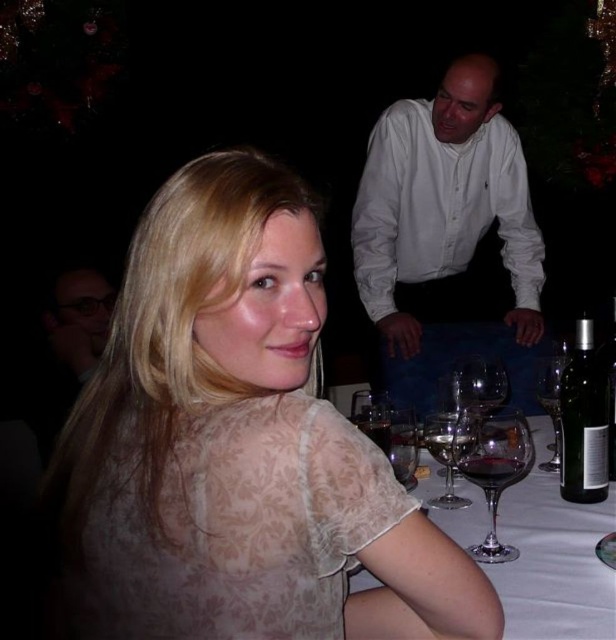
Question: Which of the following is the closest to the observer?

Choices:
 (A) transparent glass wine glass at lower right
 (B) white glassware at lower center
 (C) black glass bottle at right
 (D) green glass bottle at right

Answer: (B)

Question: Does white cotton shirt at upper right appear over clear glass wine glass at center?

Choices:
 (A) yes
 (B) no

Answer: (A)

Question: Which point appears closest to the camera in this image?

Choices:
 (A) [610, 440]
 (B) [376, 412]
 (C) [452, 458]

Answer: (C)

Question: Observing the image, what is the correct spatial positioning of transparent glass wine glass at lower right in reference to dark red glass at table right?

Choices:
 (A) above
 (B) below

Answer: (B)

Question: Does translucent floral dress at center have a greater width compared to green glass bottle at right?

Choices:
 (A) yes
 (B) no

Answer: (A)

Question: Which point appears closest to the camera in this image?

Choices:
 (A) (373, 426)
 (B) (463, 451)

Answer: (B)